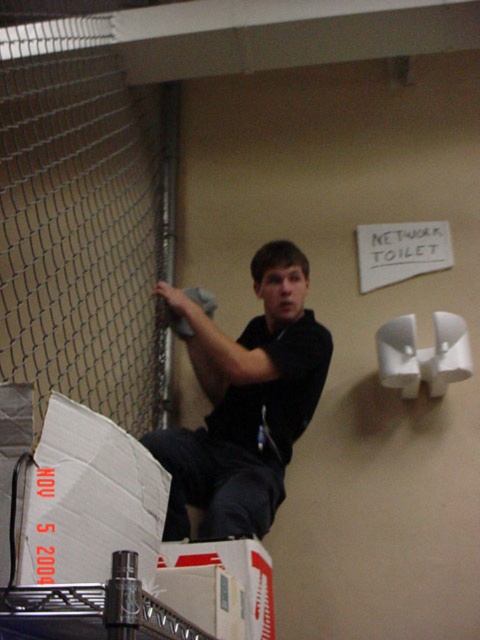
Does point (308, 365) come closer to viewer compared to point (167, 548)?

No, it is behind (167, 548).

Looking at this image, does black matte shirt at upper center have a smaller size compared to white cardboard box at lower center?

Incorrect, black matte shirt at upper center is not smaller in size than white cardboard box at lower center.

Identify the location of black matte shirt at upper center. (244, 403).

The image size is (480, 640). Identify the location of black matte shirt at upper center. (244, 403).